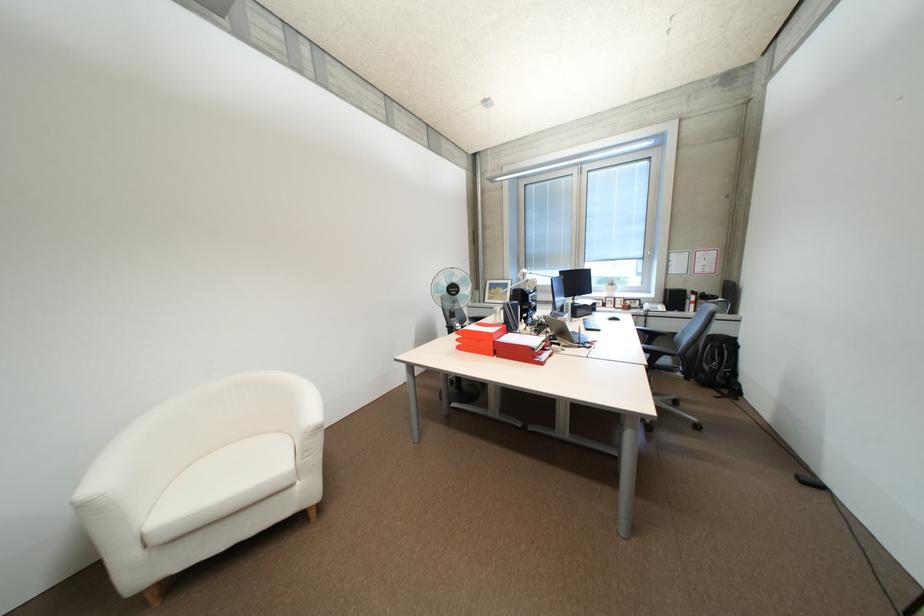
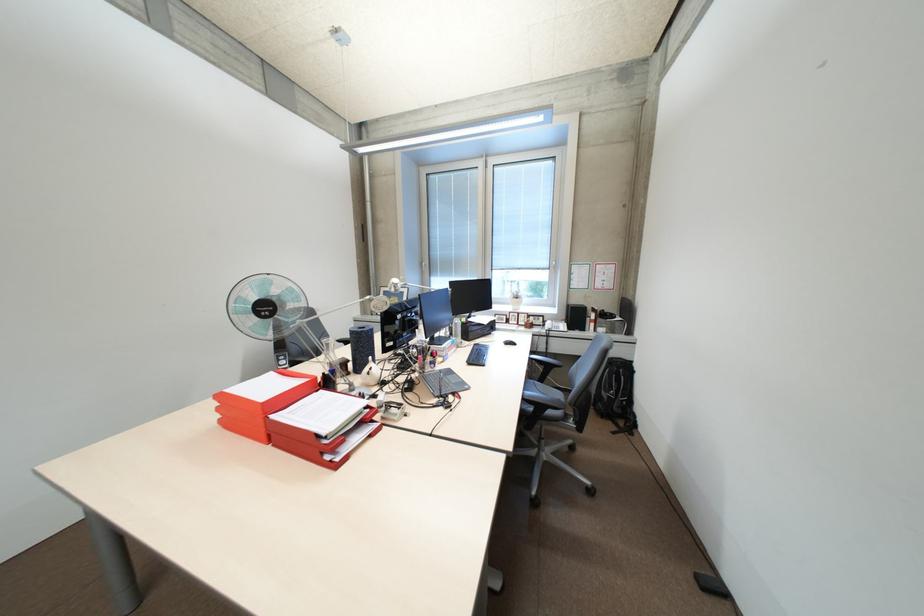
In the second image, find the point that corresponds to [468,346] in the first image.

(231, 421)